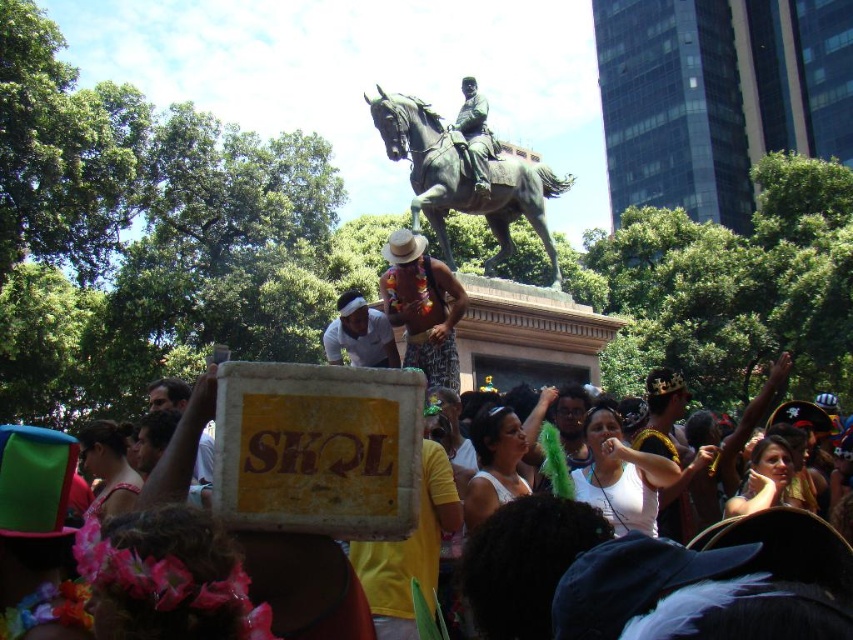
Question: Among these points, which one is nearest to the camera?

Choices:
 (A) (467, 92)
 (B) (209, 477)
 (C) (426, 317)
 (D) (698, 580)

Answer: (D)

Question: Based on their relative distances, which object is farther from the white cardboard sign at center?

Choices:
 (A) white matte shirt at center
 (B) printed fabric dress at center

Answer: (A)

Question: Is white matte shirt at center smaller than dark brown leather jacket at center?

Choices:
 (A) no
 (B) yes

Answer: (B)

Question: Can you confirm if printed fabric dress at center is smaller than bronze statue at center?

Choices:
 (A) yes
 (B) no

Answer: (B)

Question: Is the position of white matte shirt at center more distant than that of bronze statue at center?

Choices:
 (A) yes
 (B) no

Answer: (B)

Question: Which object is the closest to the bronze/statue at center?

Choices:
 (A) printed fabric dress at center
 (B) dark brown leather jacket at center
 (C) white matte shirt at center

Answer: (A)